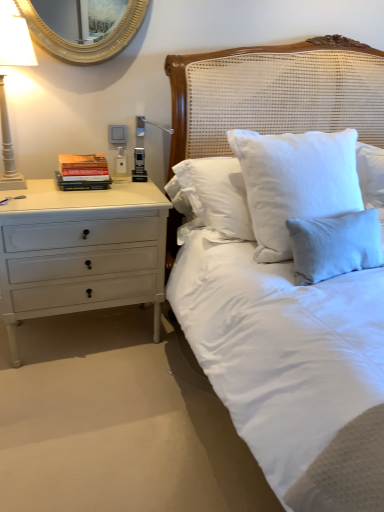
You are a GUI agent. You are given a task and a screenshot of the screen. Output one action in this format:
    pyautogui.click(x=<x>, y=<y>)
    Task: Click on the free spot below white painted wood floor lamp at left (from a real-world perspective)
    
    Given the screenshot: What is the action you would take?
    pyautogui.click(x=33, y=188)